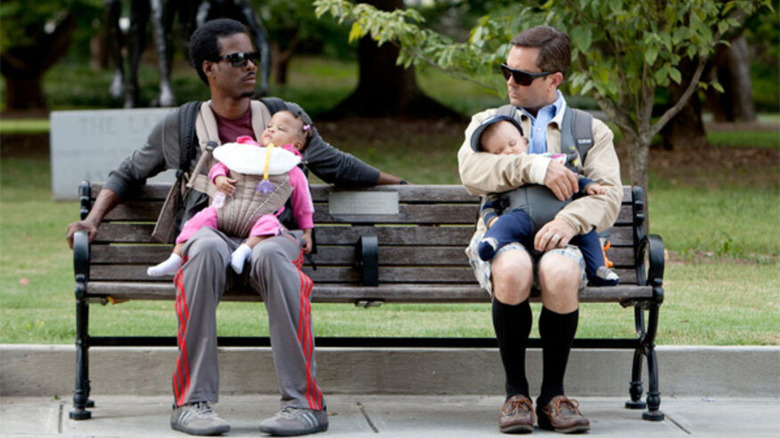
At what (x,y) coordinates should I click in order to perform the action: click on "backrest" of bench. Please return your answer as a coordinate pair (x, y). The image size is (780, 438). Looking at the image, I should click on (434, 214), (434, 197), (434, 236), (130, 211), (129, 237), (132, 256), (622, 235), (622, 256), (438, 256).